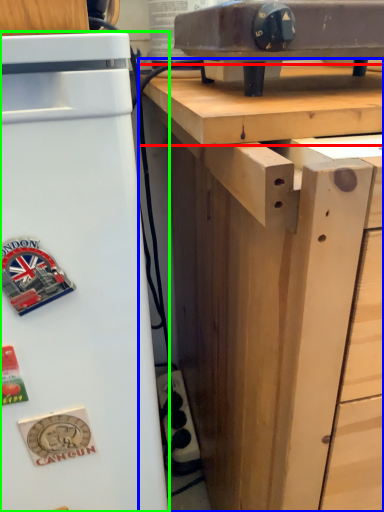
Question: Estimate the real-world distances between objects in this image. Which object is closer to wood (highlighted by a red box), desk (highlighted by a blue box) or refrigerator (highlighted by a green box)?

Choices:
 (A) desk
 (B) refrigerator

Answer: (A)